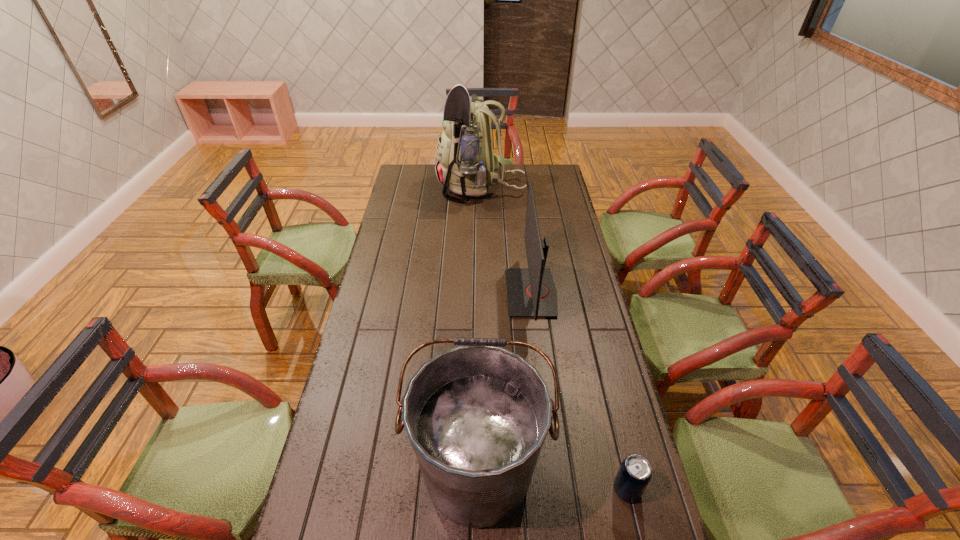
The image size is (960, 540). What are the coordinates of `free space between the soda can and the monitor` in the screenshot? It's located at (579, 392).

Locate an element on the screen. The width and height of the screenshot is (960, 540). free spot between the rightmost object and the backpack is located at coordinates (554, 339).

Locate an element on the screen. vacant space that's between the soda can and the third nearest object is located at coordinates (579, 392).

Where is `free spot between the monitor and the shortest object`? The image size is (960, 540). free spot between the monitor and the shortest object is located at coordinates (579, 392).

Identify the location of object identified as the closest to the monitor. (476, 415).

At what (x,y) coordinates should I click in order to perform the action: click on object that can be found as the closest to the backpack. Please return your answer as a coordinate pair (x, y). This screenshot has width=960, height=540. Looking at the image, I should click on click(531, 292).

What are the coordinates of `free space in the image that satisfies the following two spatial constraints: 1. on the screen side of the monitor; 2. on the right side of the rightmost object` in the screenshot? It's located at (556, 490).

Locate an element on the screen. This screenshot has width=960, height=540. free space that satisfies the following two spatial constraints: 1. on the front-facing side of the backpack; 2. on the right side of the shortest object is located at coordinates (482, 490).

This screenshot has height=540, width=960. Find the location of `free location that satisfies the following two spatial constraints: 1. on the screen side of the rightmost object; 2. on the right side of the second farthest object`. free location that satisfies the following two spatial constraints: 1. on the screen side of the rightmost object; 2. on the right side of the second farthest object is located at coordinates (556, 490).

At what (x,y) coordinates should I click in order to perform the action: click on free space that satisfies the following two spatial constraints: 1. on the screen side of the third nearest object; 2. on the right side of the soda can. Please return your answer as a coordinate pair (x, y). Looking at the image, I should click on (556, 490).